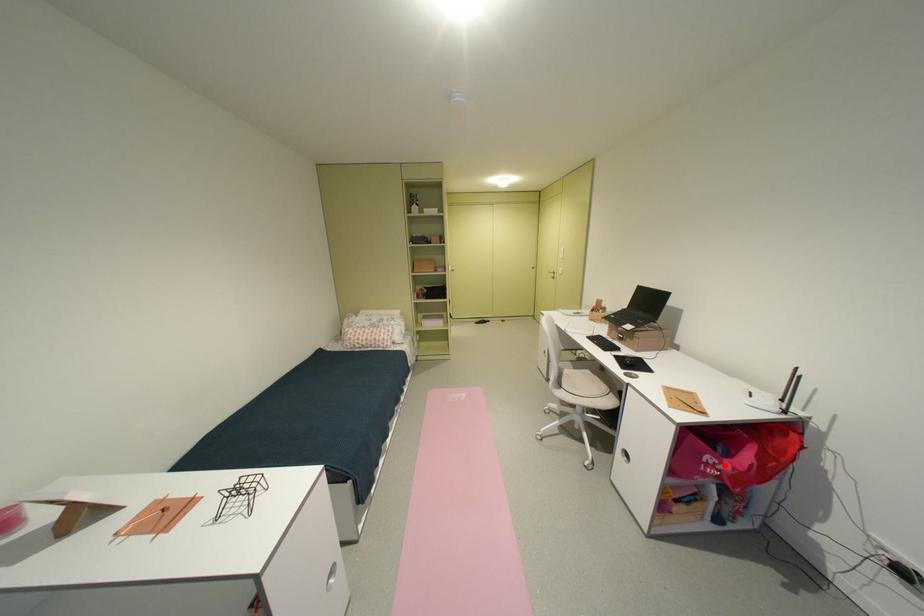
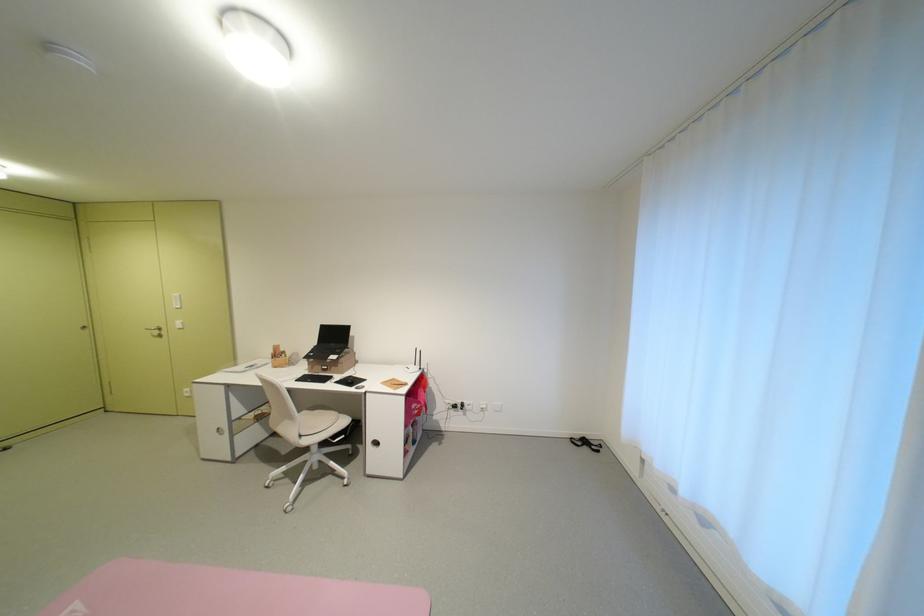
Locate, in the second image, the point that corresponds to the highlighted location in the first image.

(424, 408)